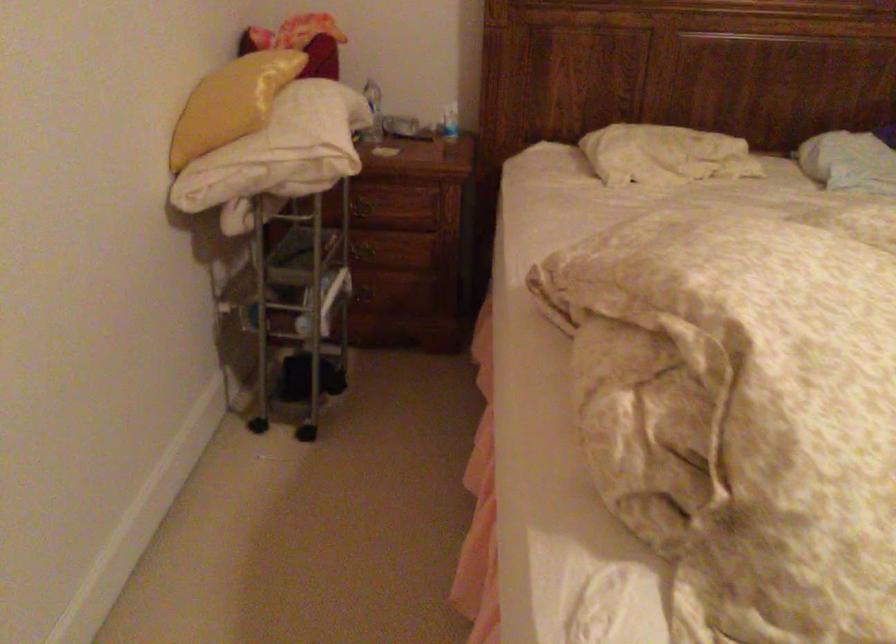
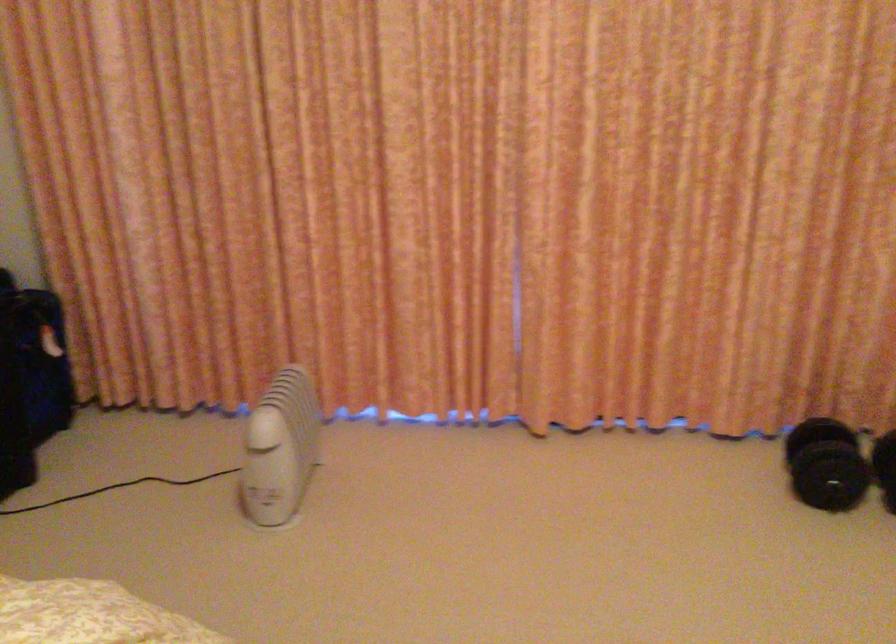
Question: The camera is either moving clockwise (left) or counter-clockwise (right) around the object. The first image is from the beginning of the video and the second image is from the end. Is the camera moving left or right when shooting the video?

Choices:
 (A) Left
 (B) Right

Answer: (A)